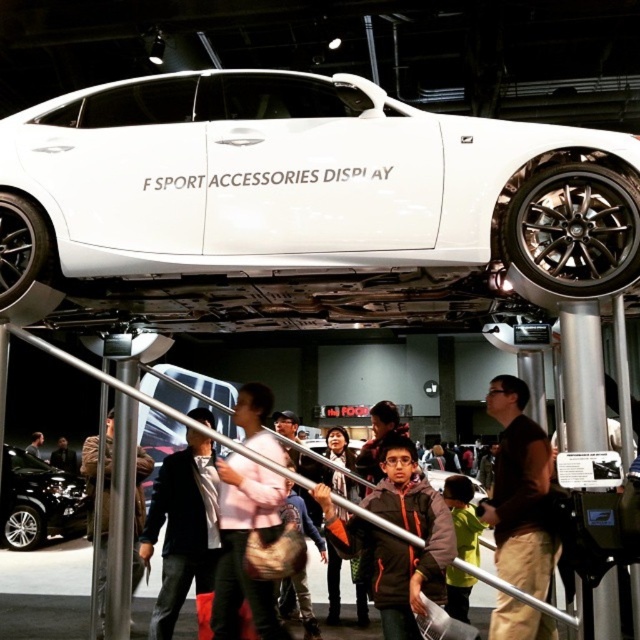
Question: Among these points, which one is nearest to the camera?

Choices:
 (A) (33, 474)
 (B) (36, 432)
 (C) (465, 614)

Answer: (C)

Question: Is orange fleece jacket at center closer to camera compared to dark brown leather jacket at center?

Choices:
 (A) yes
 (B) no

Answer: (A)

Question: Estimate the real-world distances between objects in this image. Which object is farther from the shiny black car at center?

Choices:
 (A) brown fabric shirt at center
 (B) brown leather jacket at center
 (C) dark brown leather jacket at lower center
 (D) light pink fabric jacket at center

Answer: (A)

Question: Does shiny black car at center appear under dark brown leather jacket at lower center?

Choices:
 (A) yes
 (B) no

Answer: (B)

Question: Is dark brown leather jacket at center further to the viewer compared to light brown leather jacket at center?

Choices:
 (A) no
 (B) yes

Answer: (A)

Question: Which of the following is the farthest from the observer?

Choices:
 (A) (134, 486)
 (B) (342, 552)

Answer: (A)